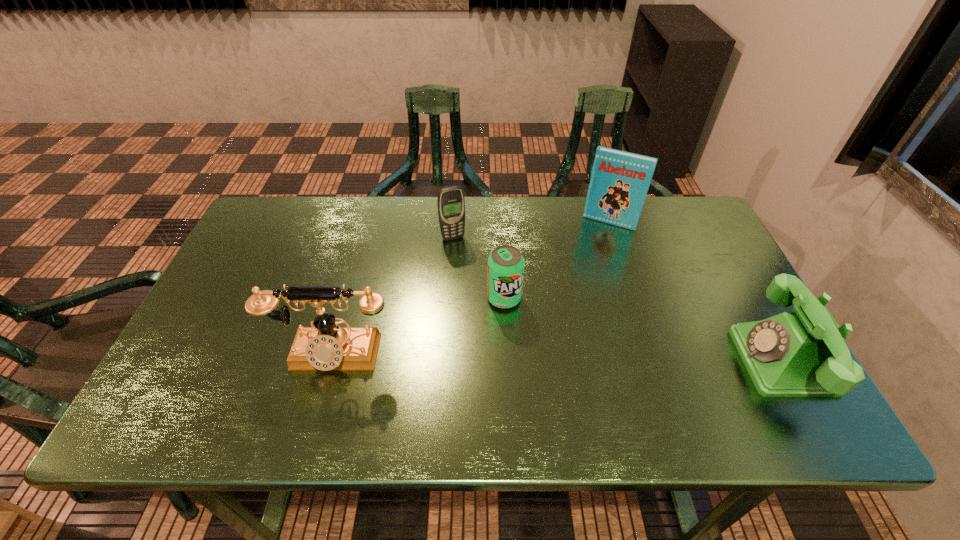
Identify the location of free spot on the desktop that is between the left telephone and the rightmost object and is positioned on the screen of the second farthest object. This screenshot has height=540, width=960. (510, 357).

Locate an element on the screen. This screenshot has height=540, width=960. vacant space on the desktop that is between the leftmost object and the shorter telephone and is positioned on the front cover of the farthest object is located at coordinates (555, 358).

The height and width of the screenshot is (540, 960). What are the coordinates of `vacant space on the desktop that is between the taller telephone and the right telephone and is positioned on the front-facing side of the pop soda` in the screenshot? It's located at (549, 358).